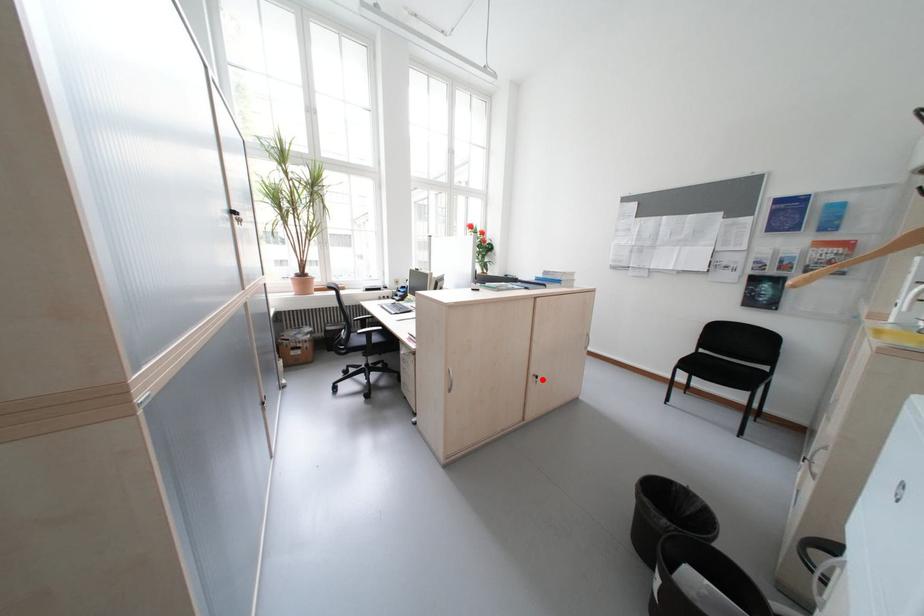
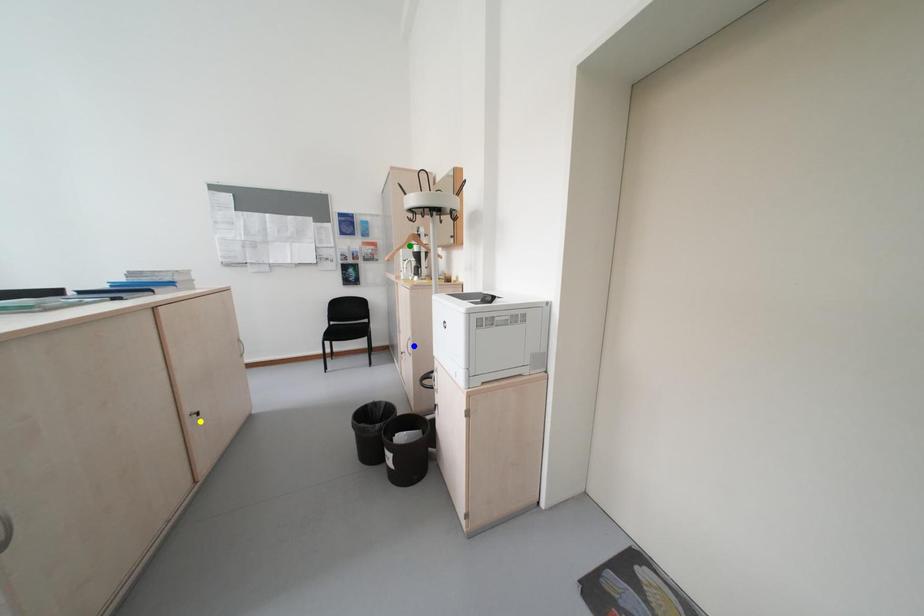
Question: I am providing you with two images of the same scene from different viewpoints. A red point is marked on the first image. You are given multiple points on the second image. In image 2, which mark is for the same physical point as the one in image 1?

Choices:
 (A) yellow point
 (B) green point
 (C) blue point

Answer: (A)